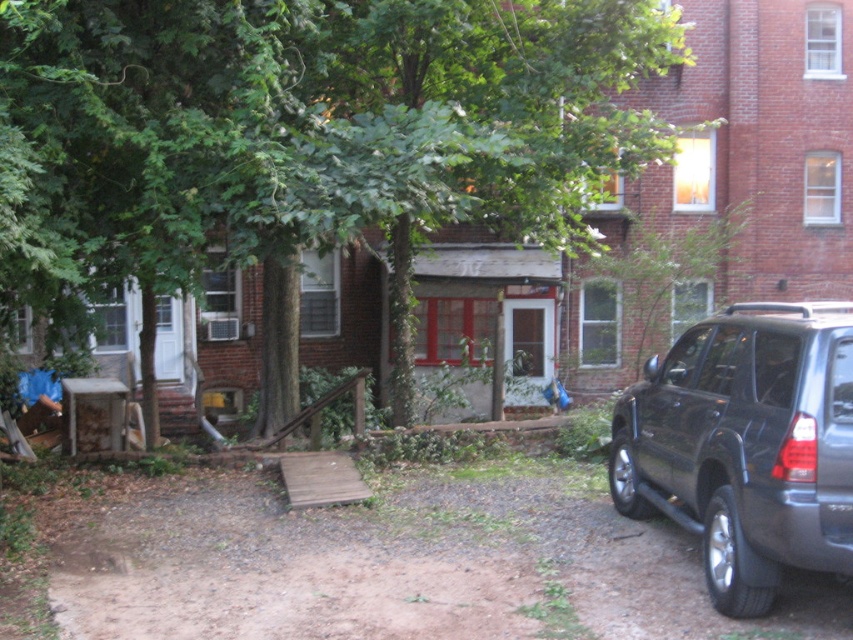
Question: Among these points, which one is nearest to the camera?

Choices:
 (A) (286, 246)
 (B) (218, 630)
 (C) (642, 396)

Answer: (B)

Question: Estimate the real-world distances between objects in this image. Which object is closer to the green leafy tree at center?

Choices:
 (A) shiny dark gray suv at right
 (B) brown gravel driveway at lower right

Answer: (B)

Question: Is brown gravel driveway at lower right thinner than shiny dark gray suv at right?

Choices:
 (A) yes
 (B) no

Answer: (B)

Question: Is green leafy tree at center further to the viewer compared to brown gravel driveway at lower right?

Choices:
 (A) yes
 (B) no

Answer: (A)

Question: Which of the following is the closest to the observer?

Choices:
 (A) (155, 81)
 (B) (421, 500)

Answer: (A)

Question: Does green leafy tree at center appear over brown gravel driveway at lower right?

Choices:
 (A) no
 (B) yes

Answer: (B)